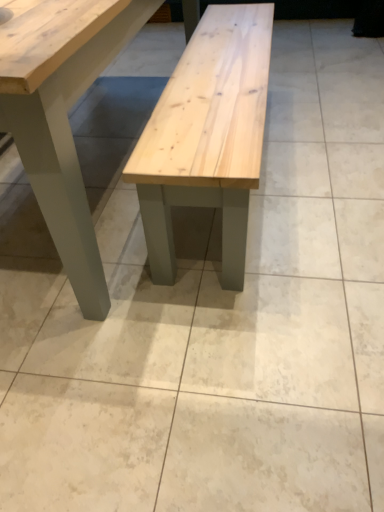
This screenshot has height=512, width=384. I want to click on natural wood table at center, so click(62, 115).

The width and height of the screenshot is (384, 512). What do you see at coordinates (62, 115) in the screenshot? I see `natural wood table at center` at bounding box center [62, 115].

Locate an element on the screen. The width and height of the screenshot is (384, 512). natural wood table at center is located at coordinates (62, 115).